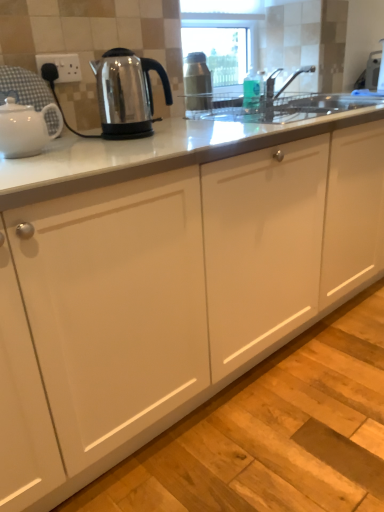
Locate an element on the screen. The height and width of the screenshot is (512, 384). vacant area located to the right-hand side of white glossy teapot at left, marked as the 2th kettle in a right-to-left arrangement is located at coordinates (92, 151).